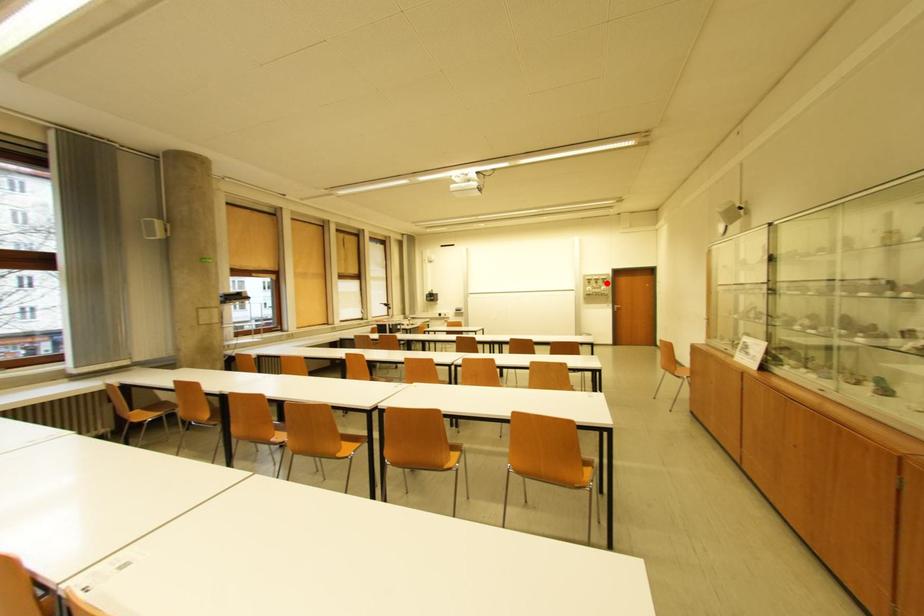
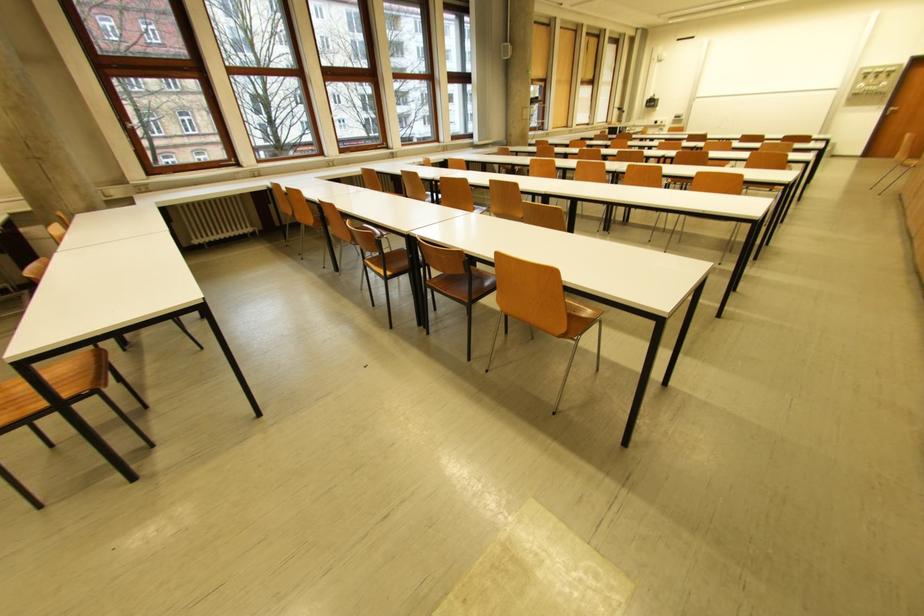
Question: A red point is marked in image1. In image2, is the corresponding 3D point closer to the camera or farther? Reply with the corresponding letter.

Choices:
 (A) The corresponding 3D point is closer.
 (B) The corresponding 3D point is farther.

Answer: (B)